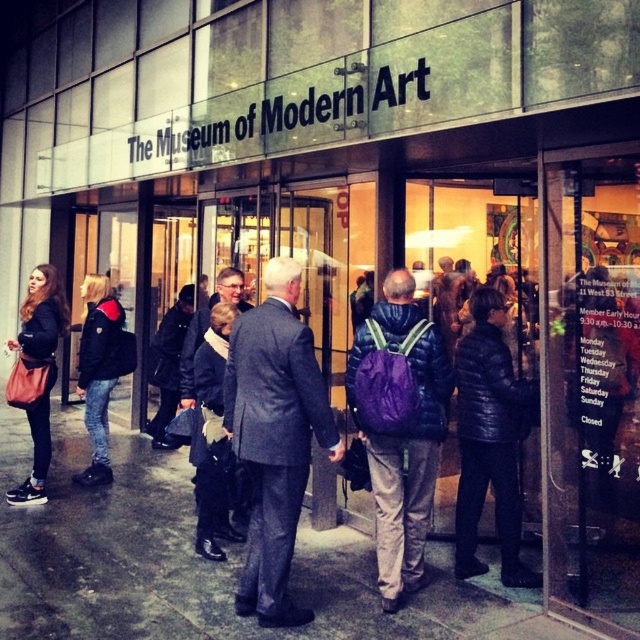
You are a photographer standing outside MoMA and want to take a picture of the gray wool suit at center and the purple matte backpack at center. Since you want to emphasize the size difference between them, which object should you zoom in on more?

You should zoom in more on the gray wool suit at center because it has a larger size compared to the purple matte backpack at center, making it easier to highlight their size contrast.

You are a photographer standing outside MoMA and want to capture both the gray wool suit at center and the matte black jacket at left in a single photo. Based on their heights, which clothing item will appear taller in the photo?

The gray wool suit at center will appear taller in the photo because it has a greater height compared to the matte black jacket at left.